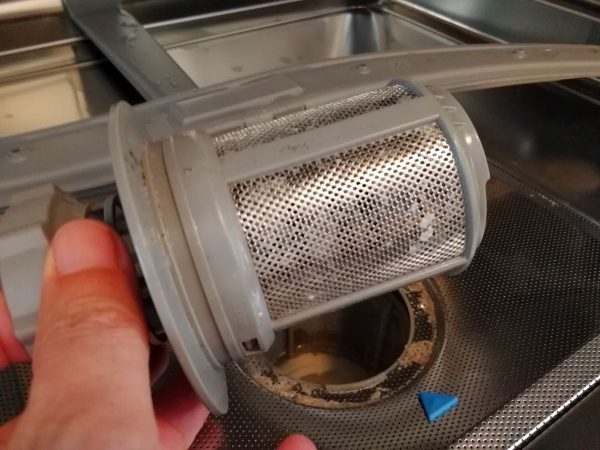
At what (x,y) coordinates should I click in order to perform the action: click on base of sink. Please return your answer as a coordinate pair (x, y). Looking at the image, I should click on (518, 274).